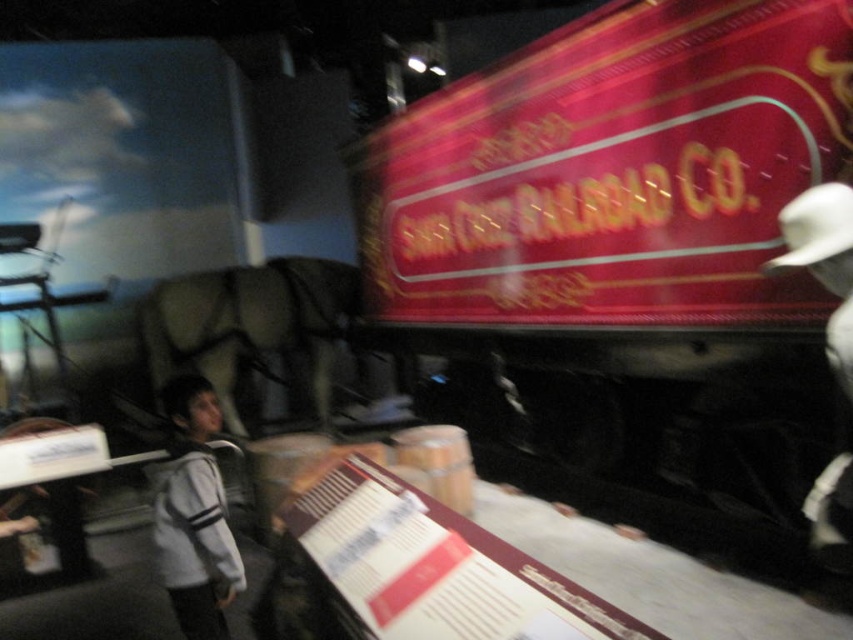
How far apart are white felt hat at right and white matte cowboy hat at upper right?

white felt hat at right and white matte cowboy hat at upper right are 1.43 inches apart from each other.

Identify the location of white felt hat at right. (824, 262).

Image resolution: width=853 pixels, height=640 pixels. I want to click on white felt hat at right, so click(824, 262).

Does shiny red metal train at upper right have a lesser height compared to white felt hat at right?

In fact, shiny red metal train at upper right may be taller than white felt hat at right.

Does shiny red metal train at upper right appear on the right side of white felt hat at right?

No, shiny red metal train at upper right is not to the right of white felt hat at right.

Is point (483, 202) positioned in front of point (834, 499)?

No, it is not.

Where is `shiny red metal train at upper right`? Image resolution: width=853 pixels, height=640 pixels. shiny red metal train at upper right is located at coordinates (624, 236).

In the scene shown: Which is below, shiny red metal train at upper right or white matte cowboy hat at upper right?

Positioned lower is white matte cowboy hat at upper right.

From the picture: Is shiny red metal train at upper right further to the viewer compared to white matte cowboy hat at upper right?

Yes.

Looking at this image, measure the distance between point (711, 468) and camera.

3.58 meters

This screenshot has width=853, height=640. In order to click on shiny red metal train at upper right in this screenshot , I will do `click(624, 236)`.